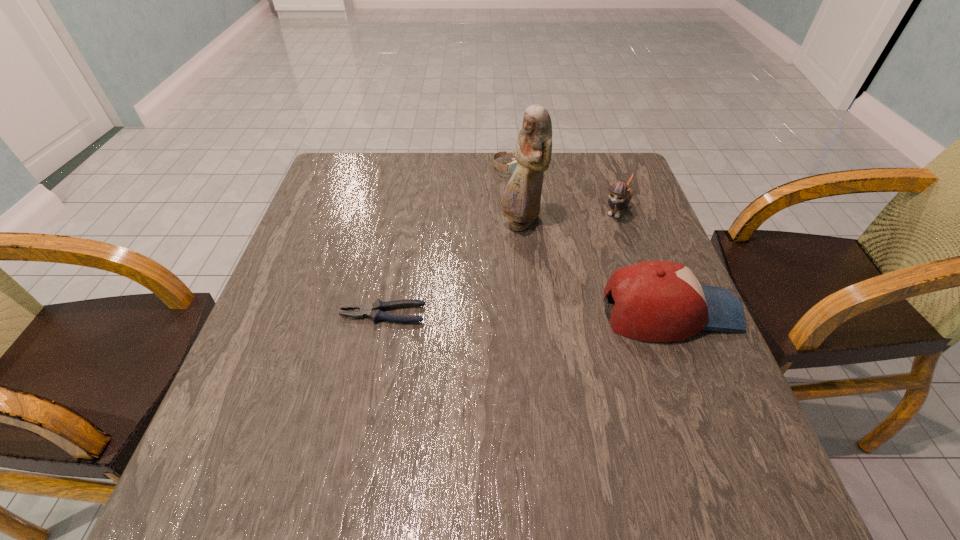
At what (x,y) coordinates should I click in order to perform the action: click on vacant space in between the baseball cap and the kitten. Please return your answer as a coordinate pair (x, y). Looking at the image, I should click on (643, 261).

Locate an element on the screen. The width and height of the screenshot is (960, 540). free space between the figurine and the pliers is located at coordinates (451, 269).

You are a GUI agent. You are given a task and a screenshot of the screen. Output one action in this format:
    pyautogui.click(x=<x>, y=<y>)
    Task: Click on the free space between the tallest object and the baseball cap
    The image size is (960, 540).
    Given the screenshot: What is the action you would take?
    pyautogui.click(x=595, y=268)

This screenshot has height=540, width=960. I want to click on vacant region between the pliers and the watch, so click(x=448, y=241).

Where is `free area in between the kitten and the figurine`? Image resolution: width=960 pixels, height=540 pixels. free area in between the kitten and the figurine is located at coordinates (568, 217).

What are the coordinates of `vacant area between the baseball cap and the tallest object` in the screenshot? It's located at (595, 268).

Locate an element on the screen. This screenshot has height=540, width=960. vacant point located between the leftmost object and the tallest object is located at coordinates (451, 269).

Locate an element on the screen. This screenshot has height=540, width=960. blank region between the farthest object and the baseball cap is located at coordinates (592, 240).

This screenshot has height=540, width=960. I want to click on object that ranks as the closest to the farthest object, so click(x=521, y=200).

Point out which object is positioned as the third nearest to the baseball cap. Please provide its 2D coordinates. Your answer should be formatted as a tuple, i.e. [(x, y)], where the tuple contains the x and y coordinates of a point satisfying the conditions above.

[(375, 310)]